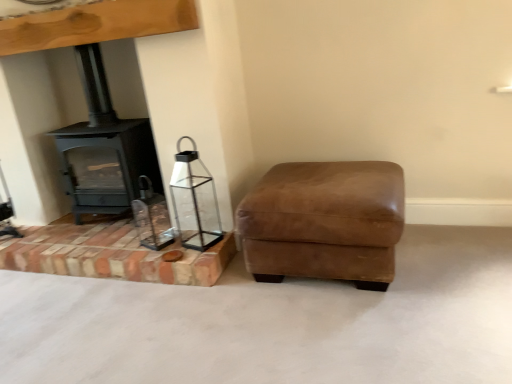
Find the location of a particular element. suede brown ottoman at lower right is located at coordinates (324, 222).

The height and width of the screenshot is (384, 512). Describe the element at coordinates (104, 148) in the screenshot. I see `matte black wood burning stove at left` at that location.

At what (x,y) coordinates should I click in order to perform the action: click on suede brown ottoman at lower right. Please return your answer as a coordinate pair (x, y). Image resolution: width=512 pixels, height=384 pixels. Looking at the image, I should click on (324, 222).

Between matte black wood burning stove at left and clear glass lantern at lower left, which one has smaller size?

Smaller between the two is clear glass lantern at lower left.

Which object is closer to the camera, matte black wood burning stove at left or clear glass lantern at lower left?

Positioned in front is clear glass lantern at lower left.

Considering the positions of point (149, 170) and point (189, 160), is point (149, 170) closer or farther from the camera than point (189, 160)?

Point (149, 170) is positioned farther from the camera compared to point (189, 160).

Is matte black wood burning stove at left aimed at clear glass lantern at lower left?

No, matte black wood burning stove at left is not facing towards clear glass lantern at lower left.

From a real-world perspective, is clear glass lantern at lower left above or below suede brown ottoman at lower right?

In terms of real-world spatial position, clear glass lantern at lower left is above suede brown ottoman at lower right.

Would you say clear glass lantern at lower left is outside suede brown ottoman at lower right?

Yes, clear glass lantern at lower left is outside of suede brown ottoman at lower right.

This screenshot has width=512, height=384. In order to click on candle holder above the suede brown ottoman at lower right (from the image's perspective) in this screenshot , I will do `click(194, 200)`.

How many degrees apart are the facing directions of clear glass lantern at lower left and suede brown ottoman at lower right?

The facing directions of clear glass lantern at lower left and suede brown ottoman at lower right are 18.9 degrees apart.

Is suede brown ottoman at lower right inside or outside of matte black wood burning stove at left?

suede brown ottoman at lower right is outside matte black wood burning stove at left.

From a real-world perspective, is suede brown ottoman at lower right below matte black wood burning stove at left?

Indeed, from a real-world perspective, suede brown ottoman at lower right is positioned beneath matte black wood burning stove at left.

Is suede brown ottoman at lower right taller or shorter than matte black wood burning stove at left?

suede brown ottoman at lower right is shorter than matte black wood burning stove at left.

Considering the sizes of suede brown ottoman at lower right and matte black wood burning stove at left in the image, is suede brown ottoman at lower right wider or thinner than matte black wood burning stove at left?

Considering their sizes, suede brown ottoman at lower right looks broader than matte black wood burning stove at left.

Which is in front, suede brown ottoman at lower right or clear glass lantern at lower left?

suede brown ottoman at lower right.

Which object is positioned more to the left, suede brown ottoman at lower right or clear glass lantern at lower left?

Positioned to the left is clear glass lantern at lower left.

Considering the sizes of suede brown ottoman at lower right and clear glass lantern at lower left in the image, is suede brown ottoman at lower right taller or shorter than clear glass lantern at lower left?

In the image, suede brown ottoman at lower right appears to be shorter than clear glass lantern at lower left.

Looking at this image, is suede brown ottoman at lower right located outside clear glass lantern at lower left?

suede brown ottoman at lower right lies outside clear glass lantern at lower left's area.

Is matte black wood burning stove at left smaller than suede brown ottoman at lower right?

Yes, matte black wood burning stove at left is smaller than suede brown ottoman at lower right.

Is matte black wood burning stove at left looking in the opposite direction of suede brown ottoman at lower right?

No.

Which object is positioned more to the left, matte black wood burning stove at left or suede brown ottoman at lower right?

Positioned to the left is matte black wood burning stove at left.

From a real-world perspective, is clear glass lantern at lower left beneath matte black wood burning stove at left?

Yes, from a real-world perspective, clear glass lantern at lower left is below matte black wood burning stove at left.

Is clear glass lantern at lower left next to matte black wood burning stove at left and touching it?

No, clear glass lantern at lower left is not making contact with matte black wood burning stove at left.

Where is `candle holder located on the right of matte black wood burning stove at left`? This screenshot has width=512, height=384. candle holder located on the right of matte black wood burning stove at left is located at coordinates (194, 200).

Is clear glass lantern at lower left situated inside matte black wood burning stove at left or outside?

clear glass lantern at lower left is not inside matte black wood burning stove at left, it's outside.

Image resolution: width=512 pixels, height=384 pixels. I want to click on wood burning stove above the clear glass lantern at lower left (from a real-world perspective), so click(x=104, y=148).

Identify the location of candle holder lying behind the suede brown ottoman at lower right. (194, 200).

When comparing their distances from clear glass lantern at lower left, does matte black wood burning stove at left or suede brown ottoman at lower right seem further?

suede brown ottoman at lower right is further to clear glass lantern at lower left.

Looking at the image, which one is located further to suede brown ottoman at lower right, matte black wood burning stove at left or clear glass lantern at lower left?

matte black wood burning stove at left is further to suede brown ottoman at lower right.

Considering their positions, is suede brown ottoman at lower right positioned further to matte black wood burning stove at left than clear glass lantern at lower left?

suede brown ottoman at lower right is positioned further to the anchor matte black wood burning stove at left.

When comparing their distances from suede brown ottoman at lower right, does clear glass lantern at lower left or matte black wood burning stove at left seem closer?

Among the two, clear glass lantern at lower left is located nearer to suede brown ottoman at lower right.

From the image, which object appears to be nearer to clear glass lantern at lower left, suede brown ottoman at lower right or matte black wood burning stove at left?

matte black wood burning stove at left lies closer to clear glass lantern at lower left than the other object.

Based on their spatial positions, is clear glass lantern at lower left or suede brown ottoman at lower right closer to matte black wood burning stove at left?

clear glass lantern at lower left.

Locate an element on the screen. The image size is (512, 384). candle holder between matte black wood burning stove at left and suede brown ottoman at lower right in the horizontal direction is located at coordinates (194, 200).